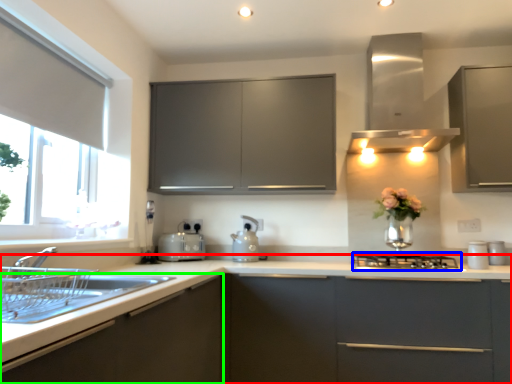
Question: Which is nearer to the countertop (highlighted by a red box)? gas stove (highlighted by a blue box) or cabinetry (highlighted by a green box).

Choices:
 (A) gas stove
 (B) cabinetry

Answer: (B)